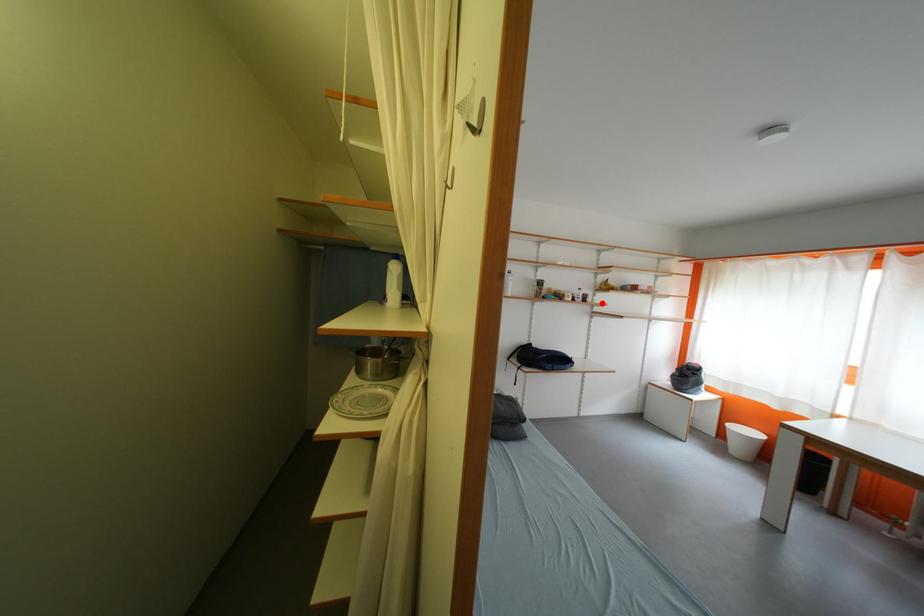
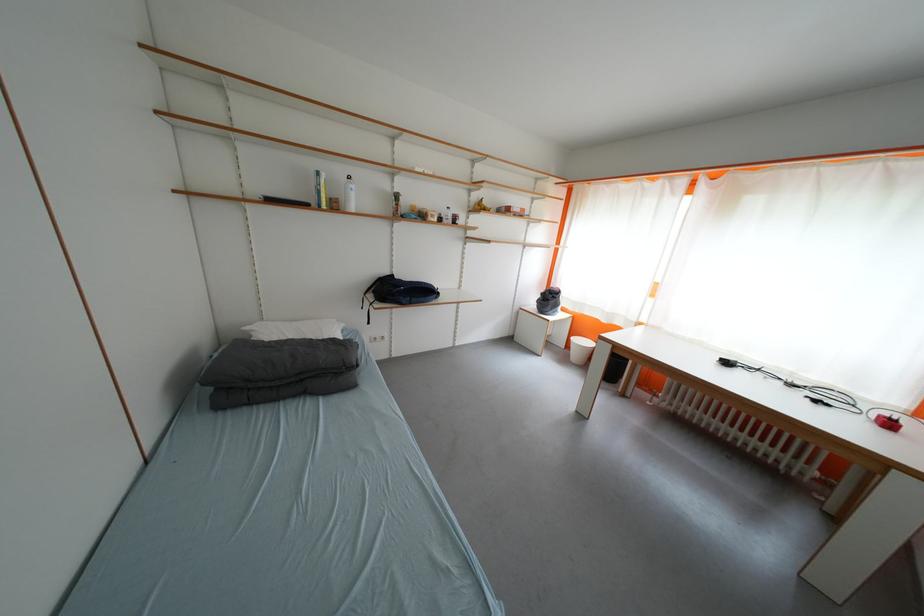
Locate, in the second image, the point that corresponds to the highlighted location in the first image.

(476, 225)